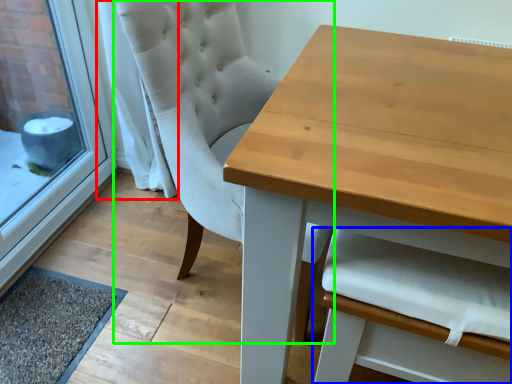
Question: Estimate the real-world distances between objects in this image. Which object is farther from curtain (highlighted by a red box), armchair (highlighted by a blue box) or chair (highlighted by a green box)?

Choices:
 (A) armchair
 (B) chair

Answer: (A)